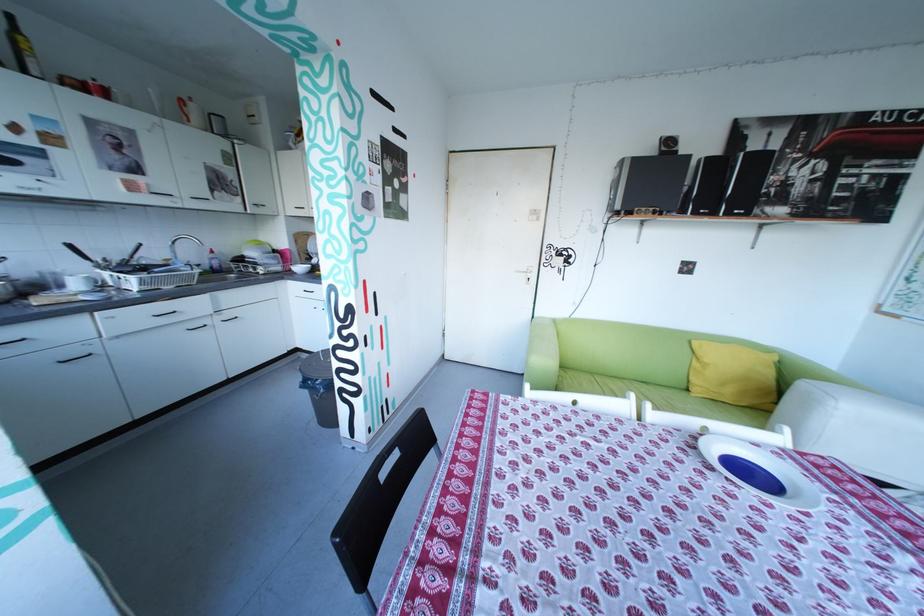
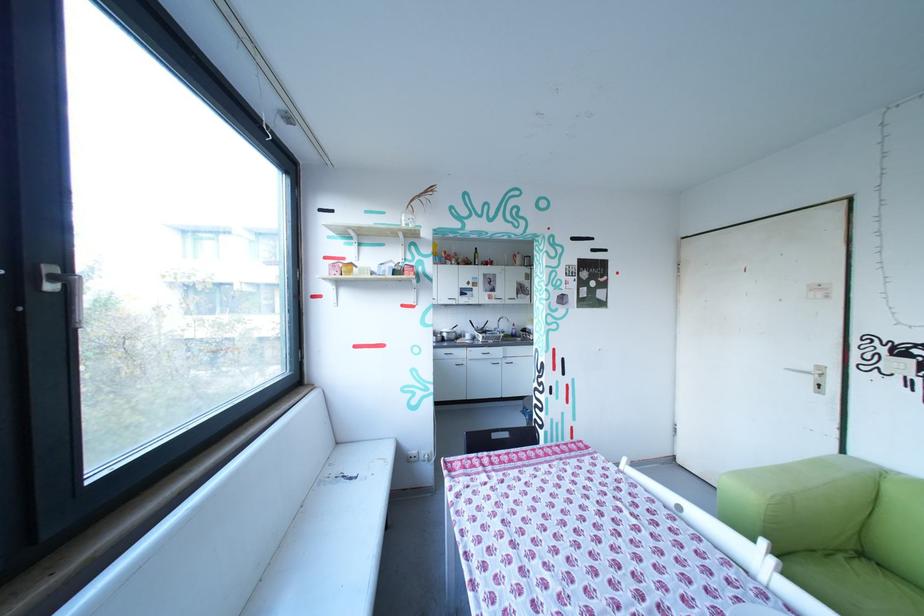
Locate, in the second image, the point that corresponds to point 537,276 in the first image.

(821, 379)